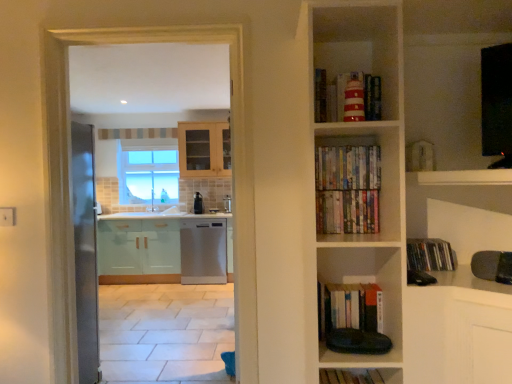
Locate an element on the screen. The height and width of the screenshot is (384, 512). free space above multicolored paperbacks at center, the third book when ordered from top to bottom (from a real-world perspective) is located at coordinates (342, 194).